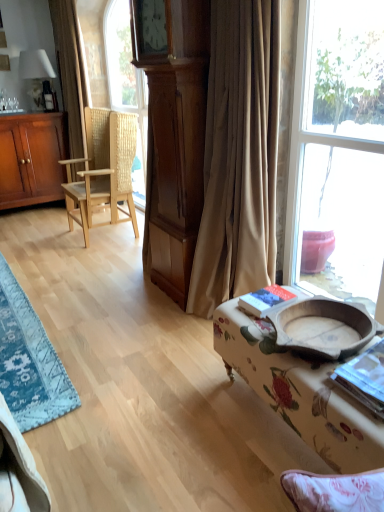
Find the location of a particular element. This screenshot has width=384, height=512. blank space situated above blue woven rug at lower left (from a real-world perspective) is located at coordinates (18, 330).